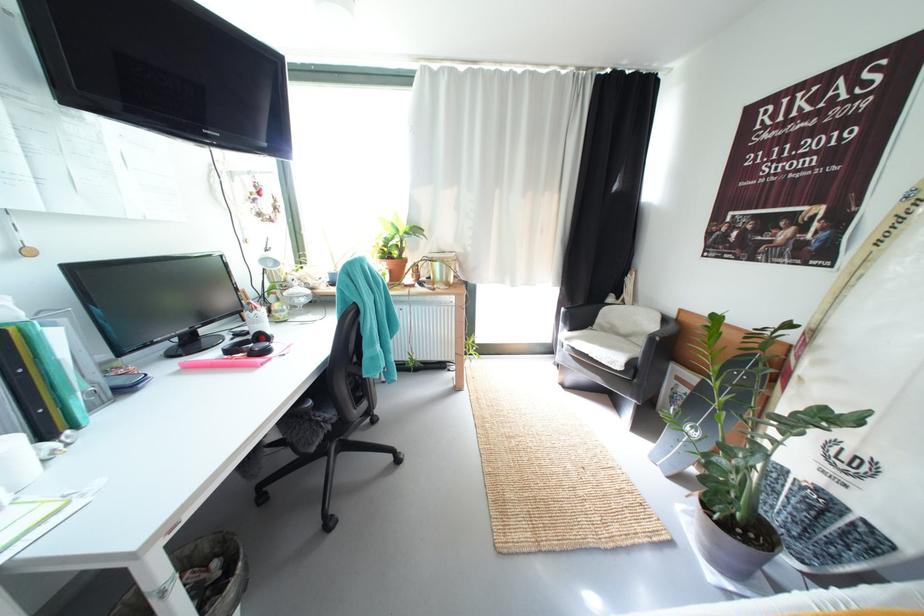
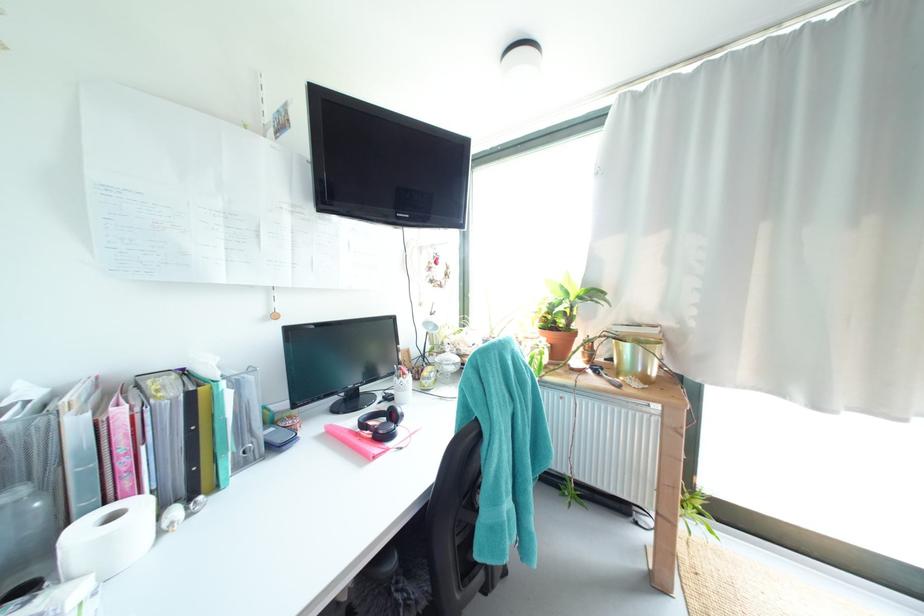
The point at (429, 286) is marked in the first image. Where is the corresponding point in the second image?

(603, 373)